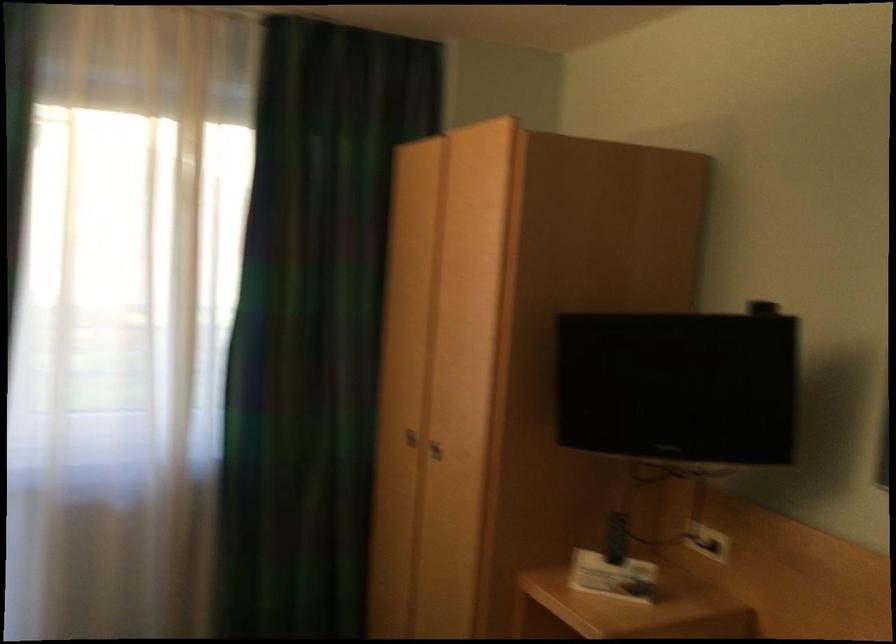
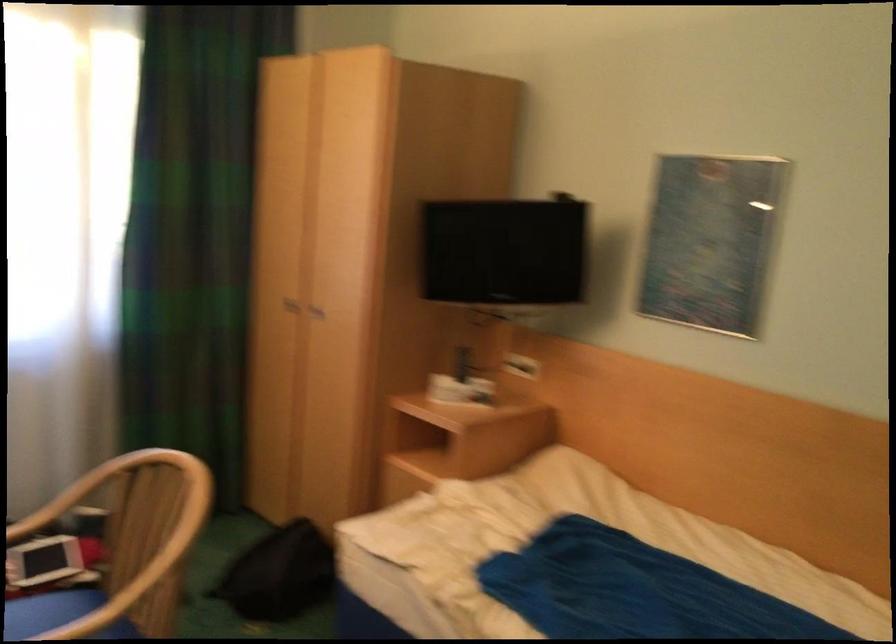
Which direction would the cameraman need to move to produce the second image?

The movement direction of the cameraman is left, backward.